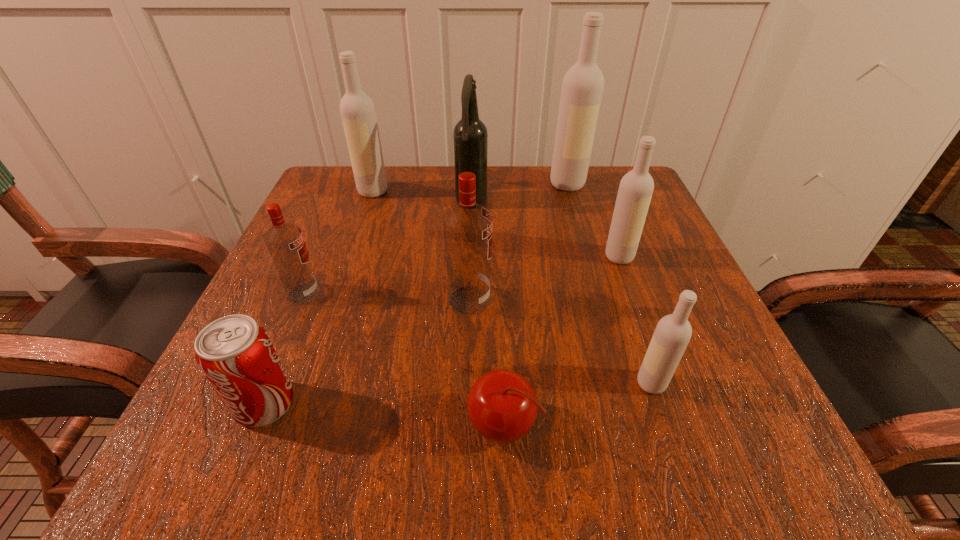
You are a GUI agent. You are given a task and a screenshot of the screen. Output one action in this format:
    pyautogui.click(x=<x>, y=<y>)
    Task: Click on the smallest white vodka
    This screenshot has width=960, height=540.
    Given the screenshot: What is the action you would take?
    pyautogui.click(x=673, y=332)

I want to click on the nearest vodka, so 673,332.

Identify the location of soda can. (235, 353).

In order to click on the second shortest object in this screenshot , I will do `click(235, 353)`.

Locate an element on the screen. This screenshot has width=960, height=540. cherry is located at coordinates (502, 406).

Identify the location of blank space located on the right of the second tallest vodka. The height and width of the screenshot is (540, 960). (492, 191).

Locate an element on the screen. free space located 0.310m on the front of the beer bottle is located at coordinates (468, 324).

Locate an element on the screen. This screenshot has width=960, height=540. vacant space located 0.060m on the left of the fourth farthest object is located at coordinates (572, 256).

You are a GUI agent. You are given a task and a screenshot of the screen. Output one action in this format:
    pyautogui.click(x=<x>, y=<y>)
    Task: Click on the vacant space located on the front label of the fourth vodka from right to left
    
    Given the screenshot: What is the action you would take?
    [671, 300]

At what (x,y) coordinates should I click in order to perform the action: click on vacant space located 0.250m on the front label of the smaller red vodka. Please return your answer as a coordinate pair (x, y). The width and height of the screenshot is (960, 540). Looking at the image, I should click on (463, 293).